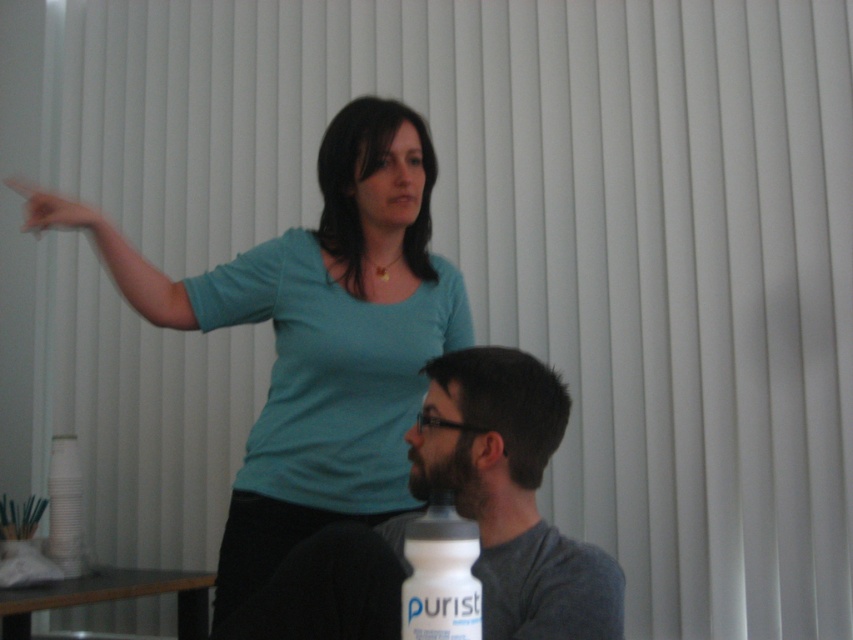
Question: Which point is farther to the camera?

Choices:
 (A) (341, 433)
 (B) (409, 620)
 (C) (306, 598)
 (D) (30, 225)

Answer: (A)

Question: Which of the following is the closest to the observer?

Choices:
 (A) (436, 605)
 (B) (538, 602)
 (C) (347, 180)
 (D) (90, 212)

Answer: (A)

Question: Is gray matte shirt at lower center bigger than white matte water bottle at lower center?

Choices:
 (A) yes
 (B) no

Answer: (A)

Question: Does teal matte shirt at upper center appear under matte skin hand at upper left?

Choices:
 (A) no
 (B) yes

Answer: (B)

Question: Which object is farther from the camera taking this photo?

Choices:
 (A) teal matte shirt at upper center
 (B) matte skin hand at upper left

Answer: (A)

Question: Does teal matte shirt at upper center appear over matte skin hand at upper left?

Choices:
 (A) yes
 (B) no

Answer: (B)